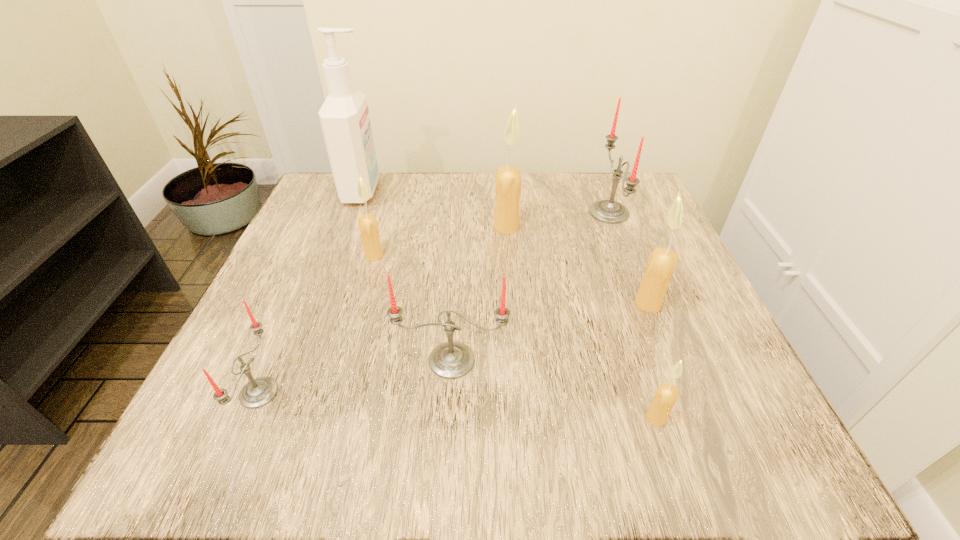
The width and height of the screenshot is (960, 540). Identify the location of the second cream candle from right to left. (667, 394).

Find the location of a particular element. The width and height of the screenshot is (960, 540). the nearest cream candle is located at coordinates (667, 394).

You are a GUI agent. You are given a task and a screenshot of the screen. Output one action in this format:
    pyautogui.click(x=<x>, y=<y>)
    Task: Click on the leftmost red candle
    
    Given the screenshot: What is the action you would take?
    pyautogui.click(x=258, y=392)

This screenshot has width=960, height=540. Identify the location of the leftmost candle. 258,392.

At what (x,y) coordinates should I click in order to perform the action: click on free space located 0.370m on the front label of the tallest object. Please return your answer as a coordinate pair (x, y). Image resolution: width=960 pixels, height=540 pixels. Looking at the image, I should click on (x=535, y=191).

Locate an element on the screen. The image size is (960, 540). free region located 0.400m on the left of the farthest cream candle is located at coordinates (308, 227).

Identify the location of vacant space located 0.360m on the front-facing side of the farthest red candle. (429, 213).

The width and height of the screenshot is (960, 540). Find the location of `free location located on the front-facing side of the farthest red candle`. free location located on the front-facing side of the farthest red candle is located at coordinates (483, 213).

What are the coordinates of `free region located 0.380m on the front-facing side of the farthest red candle` in the screenshot? It's located at (420, 213).

Find the location of a particular element. free location located 0.180m on the front of the fourth farthest candle is located at coordinates pos(687,405).